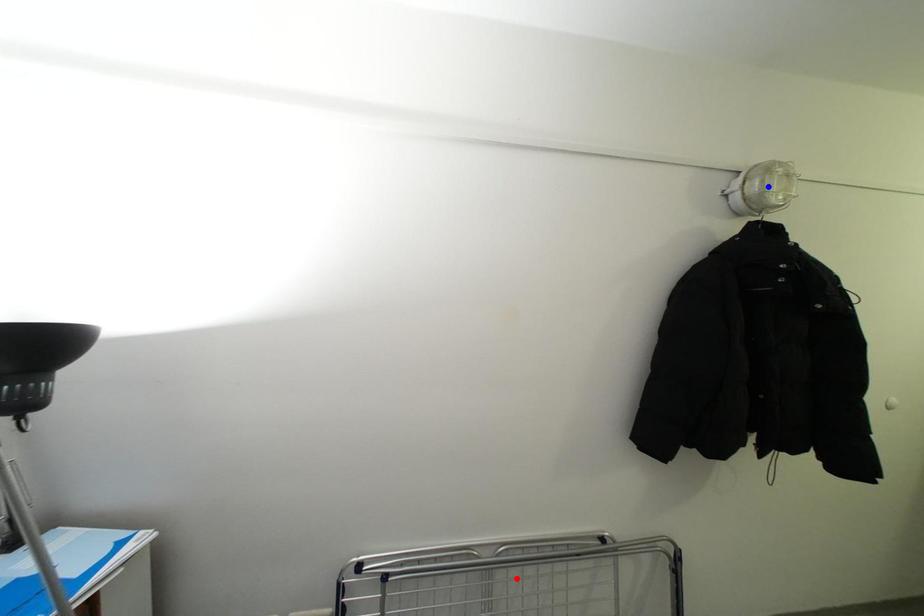
Question: In the image, two points are highlighted. Which point is nearer to the camera? Reply with the corresponding letter.

Choices:
 (A) blue point
 (B) red point

Answer: (A)